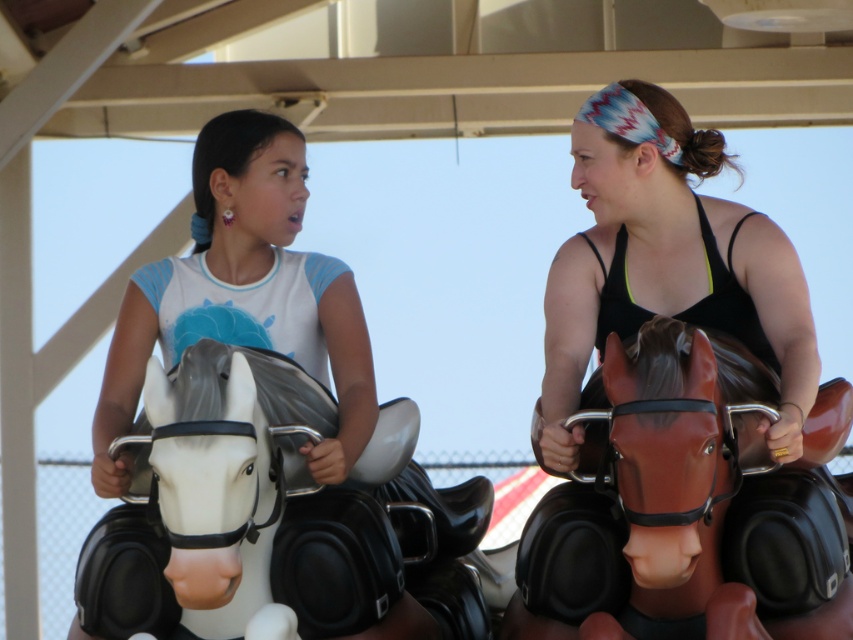
You are at the amusement park and want to locate the white matte horse at left. According to the map coordinates, where should you look?

The white matte horse at left is located at point (302, 502) on the map.

You are designing a new seating arrangement for the mechanical horse rides at the amusement park. The white matte horse at left and the matte black tank top at right are two options. Which horse ride takes up less space in the park layout?

The white matte horse at left occupies less space than the matte black tank top at right, so the white matte horse at left would take up less space in the park layout.

You are at an amusement park and see the shiny brown horse at right and the matte black tank top at right. Which object is located lower in the scene?

The shiny brown horse at right is positioned under the matte black tank top at right, so it is lower in the scene.